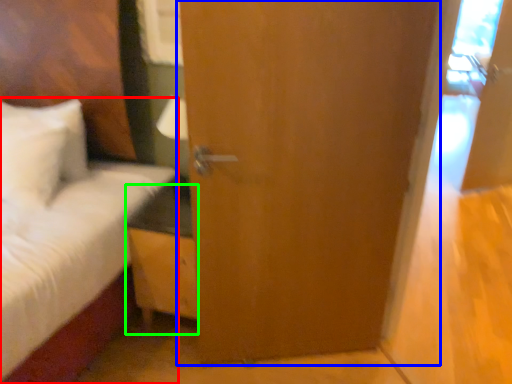
Question: Estimate the real-world distances between objects in this image. Which object is farther from bed (highlighted by a red box), door (highlighted by a blue box) or nightstand (highlighted by a green box)?

Choices:
 (A) door
 (B) nightstand

Answer: (A)